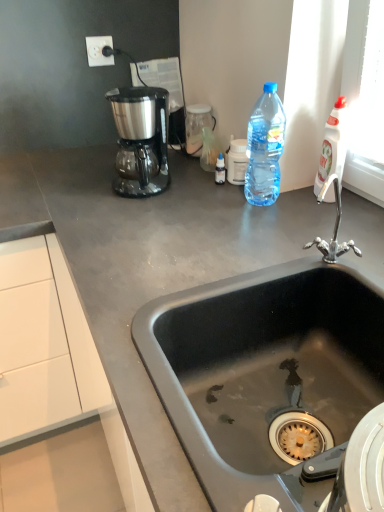
Where is `vacant region to the left of satin black coffee maker at upper left`? This screenshot has height=512, width=384. vacant region to the left of satin black coffee maker at upper left is located at coordinates (75, 189).